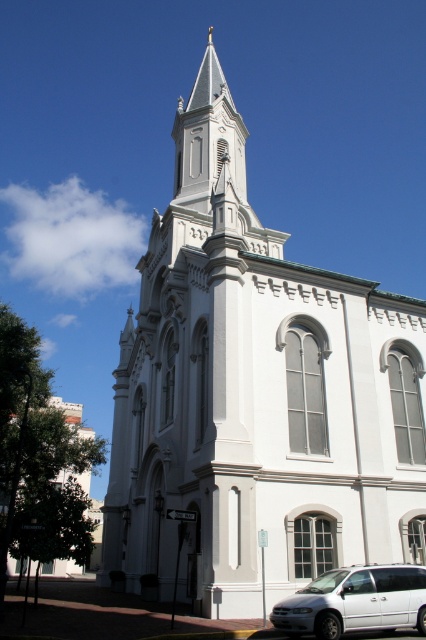
Question: Which object is farther from the camera taking this photo?

Choices:
 (A) white stone church at center
 (B) white matte van at lower right

Answer: (A)

Question: Which point appears farthest from the camera in this image?

Choices:
 (A) (356, 592)
 (B) (258, 397)

Answer: (B)

Question: Is white stone church at center positioned at the back of white matte van at lower right?

Choices:
 (A) no
 (B) yes

Answer: (B)

Question: Is white stone church at center wider than white matte van at lower right?

Choices:
 (A) no
 (B) yes

Answer: (B)

Question: Is white stone church at center to the right of white matte van at lower right from the viewer's perspective?

Choices:
 (A) yes
 (B) no

Answer: (B)

Question: Among these points, which one is nearest to the camera?

Choices:
 (A) (118, 460)
 (B) (417, 618)

Answer: (B)